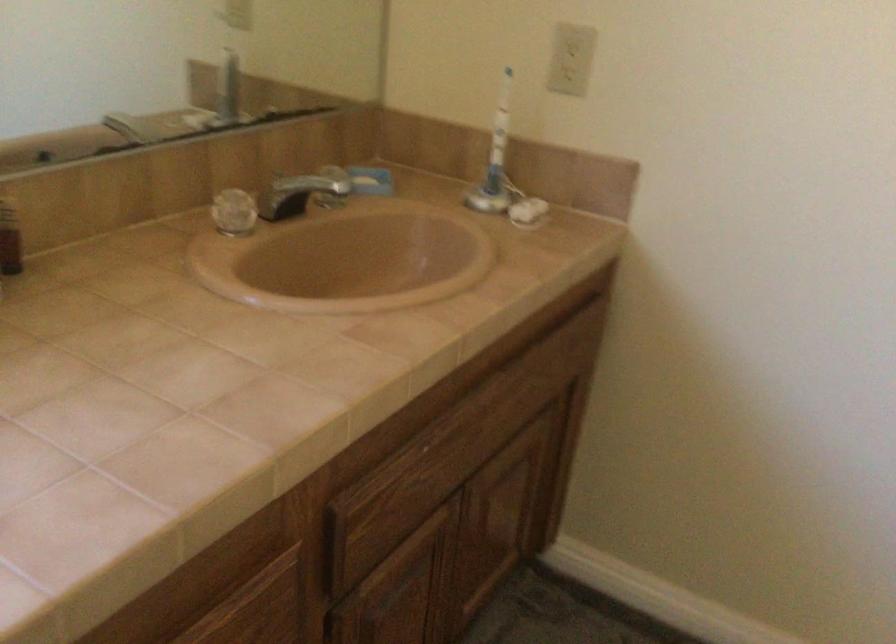
What do you see at coordinates (371, 180) in the screenshot?
I see `the blue soap dish` at bounding box center [371, 180].